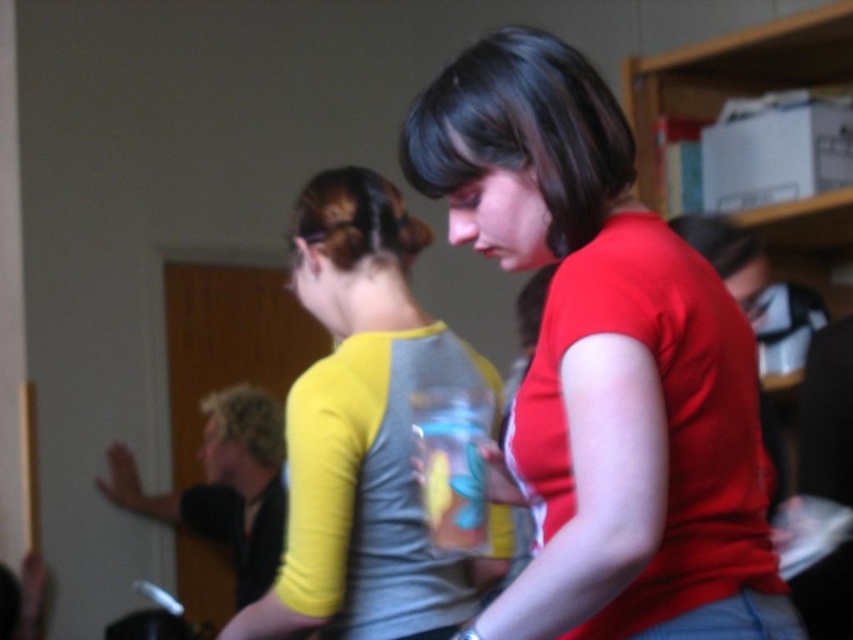
Is point (688, 538) closer to viewer compared to point (390, 460)?

Yes, point (688, 538) is closer to viewer.

Looking at this image, is red matte shirt at center below yellow-green t-shirt at center?

No, red matte shirt at center is not below yellow-green t-shirt at center.

Who is more distant from viewer, (538, 465) or (412, 531)?

The point (412, 531) is behind.

At what (x,y) coordinates should I click in order to perform the action: click on red matte shirt at center. Please return your answer as a coordinate pair (x, y). This screenshot has width=853, height=640. Looking at the image, I should click on (605, 362).